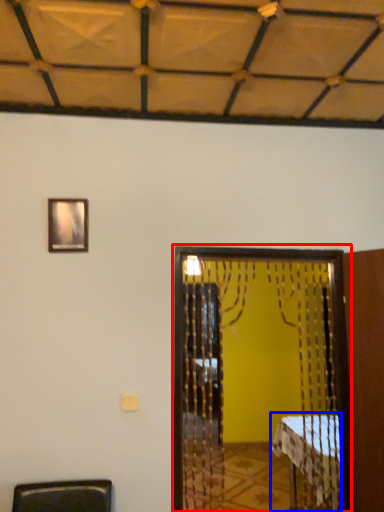
Question: Among these objects, which one is farthest to the camera, screen door (highlighted by a red box) or table (highlighted by a blue box)?

Choices:
 (A) screen door
 (B) table

Answer: (B)